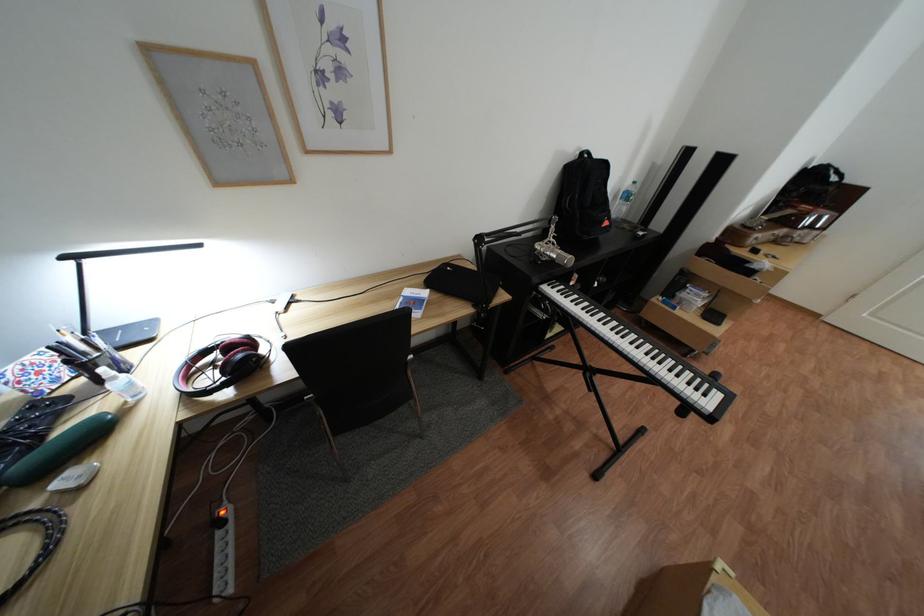
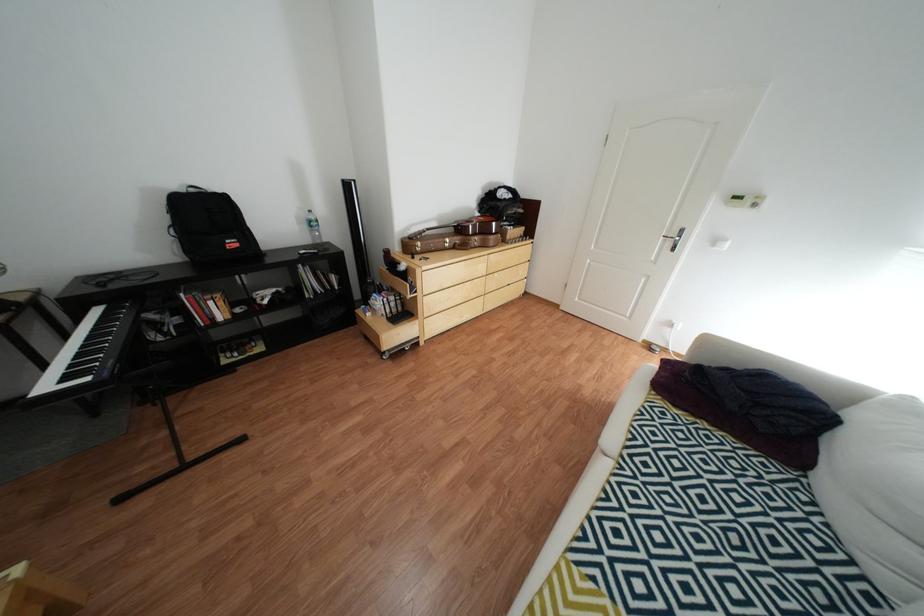
Question: In a continuous first-person perspective shot, in which direction is the camera moving?

Choices:
 (A) Left
 (B) Right
 (C) Forward
 (D) Backward

Answer: (B)